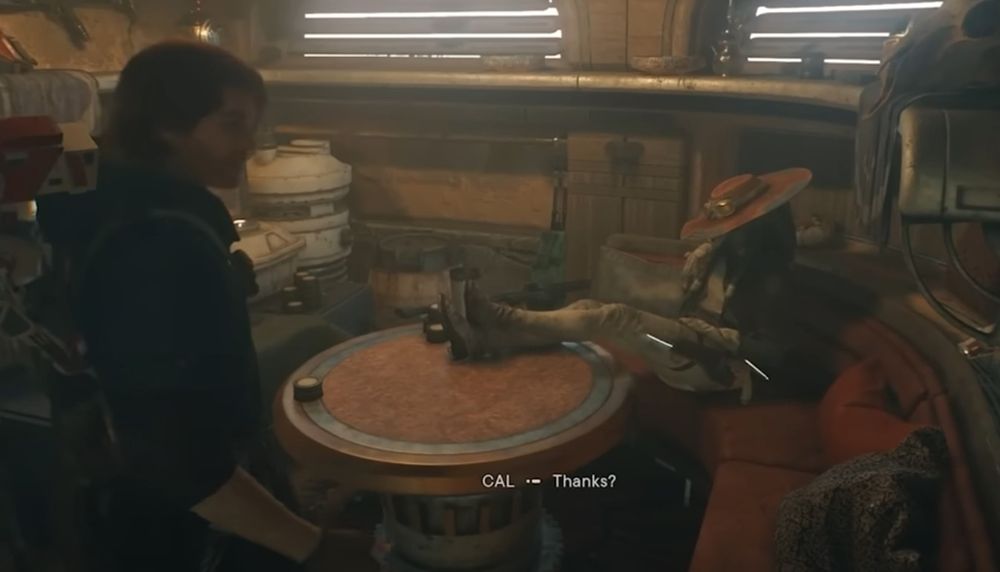
Image resolution: width=1000 pixels, height=572 pixels. I want to click on blinds, so pyautogui.click(x=437, y=38), pyautogui.click(x=795, y=47).